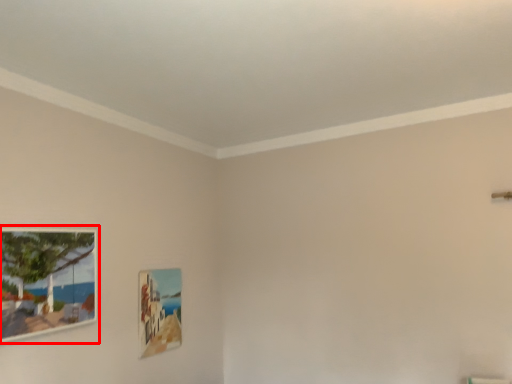
Question: In this image, where is picture frame (annotated by the red box) located relative to picture frame?

Choices:
 (A) right
 (B) left

Answer: (B)